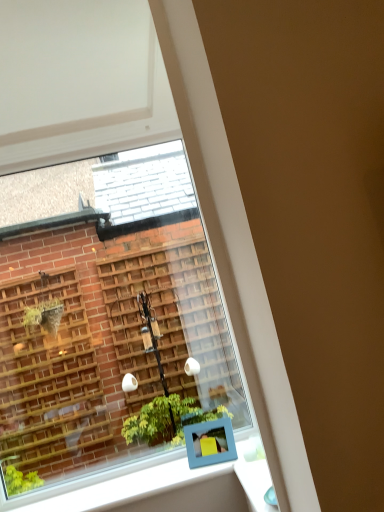
This screenshot has height=512, width=384. Find the location of `blank space situated above clear glass window at upper left (from a real-world perspective)`. blank space situated above clear glass window at upper left (from a real-world perspective) is located at coordinates (111, 141).